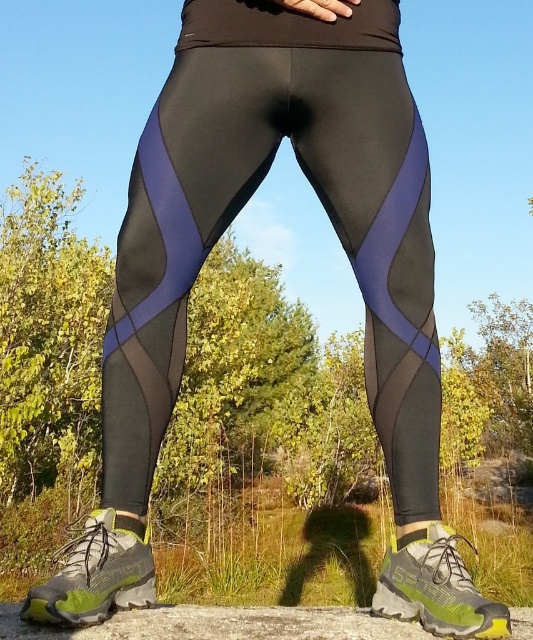
Question: Which point is farther to the camera?

Choices:
 (A) black mesh leggings at center
 (B) green mesh running shoe at lower right
 (C) green mesh running shoe at lower left

Answer: (A)

Question: Among these objects, which one is nearest to the camera?

Choices:
 (A) green mesh running shoe at lower right
 (B) green mesh running shoe at lower left

Answer: (B)

Question: Observing the image, what is the correct spatial positioning of black mesh leggings at center in reference to green mesh running shoe at lower left?

Choices:
 (A) right
 (B) left

Answer: (A)

Question: Is green mesh running shoe at lower left to the right of green mesh running shoe at lower right from the viewer's perspective?

Choices:
 (A) yes
 (B) no

Answer: (B)

Question: Which is farther from the green mesh running shoe at lower right?

Choices:
 (A) black mesh leggings at center
 (B) green mesh running shoe at lower left

Answer: (B)

Question: Does black mesh leggings at center have a larger size compared to green mesh running shoe at lower left?

Choices:
 (A) no
 (B) yes

Answer: (B)